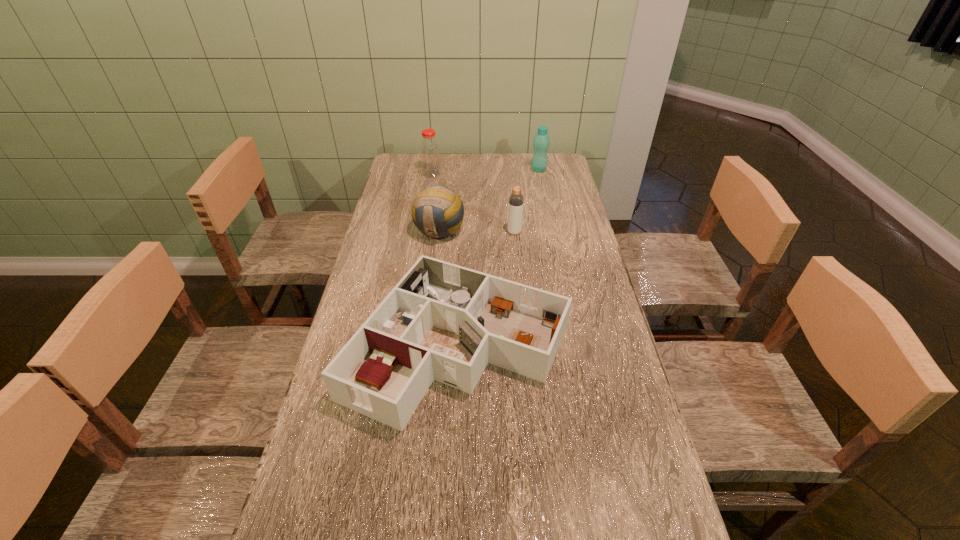
The height and width of the screenshot is (540, 960). I want to click on bottle that is at the left edge, so click(430, 156).

Find the location of `volleyball that is positioned at the left edge`. volleyball that is positioned at the left edge is located at coordinates (x=438, y=212).

Where is `dollhouse at the left edge`? dollhouse at the left edge is located at coordinates (444, 322).

Image resolution: width=960 pixels, height=540 pixels. In order to click on bottle that is positioned at the right edge in this screenshot , I will do `click(541, 142)`.

Where is `dollhouse that is at the right edge`? dollhouse that is at the right edge is located at coordinates (444, 322).

I want to click on object that is at the far left corner, so click(x=430, y=156).

The height and width of the screenshot is (540, 960). I want to click on object that is at the far right corner, so click(541, 142).

In the image, there is a desktop. In order to click on vacant space at the left edge in this screenshot , I will do `click(400, 255)`.

Where is `free space at the right edge of the desktop`? free space at the right edge of the desktop is located at coordinates (583, 287).

Find the location of a particular element. The width and height of the screenshot is (960, 540). vacant space in between the leftmost bottle and the rightmost bottle is located at coordinates (485, 172).